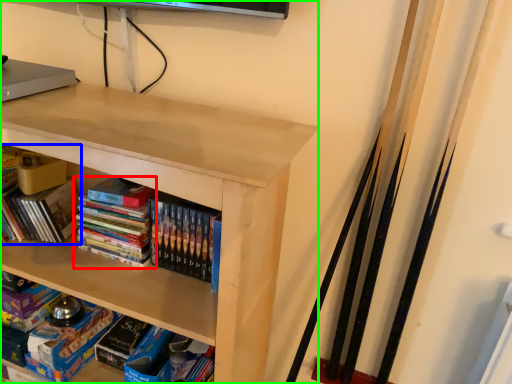
Question: Estimate the real-world distances between objects in this image. Which object is farther from book (highlighted by a red box), book (highlighted by a blue box) or shelf (highlighted by a green box)?

Choices:
 (A) book
 (B) shelf

Answer: (B)